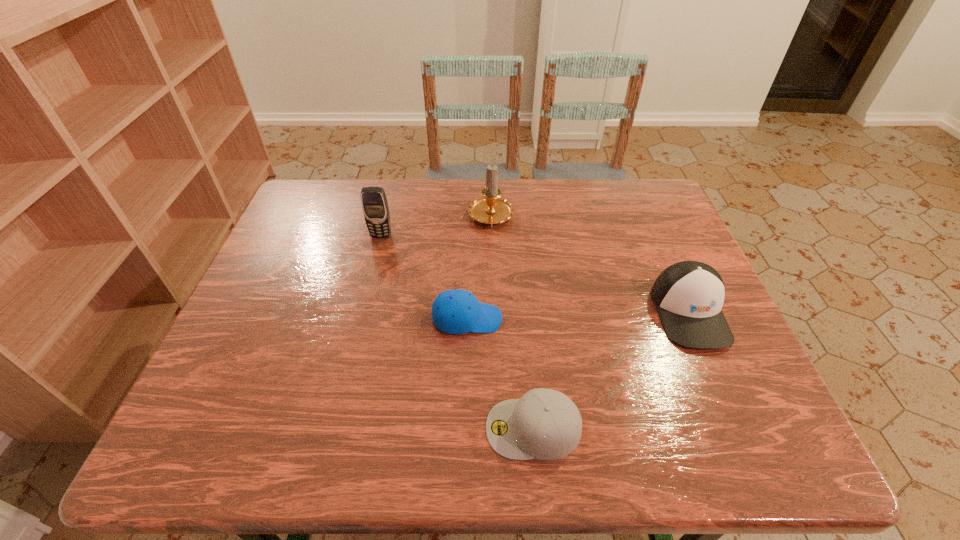
Where is `vacant area between the candle and the nearest object`? The height and width of the screenshot is (540, 960). vacant area between the candle and the nearest object is located at coordinates (512, 323).

What are the coordinates of `vacant point located between the nearest object and the candle` in the screenshot? It's located at (512, 323).

The width and height of the screenshot is (960, 540). I want to click on vacant area between the leftmost object and the tallest cap, so click(x=536, y=274).

You are a GUI agent. You are given a task and a screenshot of the screen. Output one action in this format:
    pyautogui.click(x=<x>, y=<y>)
    Task: Click on the empty location between the rightmost object and the nearest object
    
    Given the screenshot: What is the action you would take?
    pyautogui.click(x=612, y=370)

This screenshot has width=960, height=540. Identify the location of unoccupied area between the cellular telephone and the candle. (436, 227).

Locate which object ranks third in proximity to the leftmost object. Please provide its 2D coordinates. Your answer should be formatted as a tuple, i.e. [(x, y)], where the tuple contains the x and y coordinates of a point satisfying the conditions above.

[(545, 424)]

At what (x,y) coordinates should I click in order to perform the action: click on object that stands as the third closest to the nearest object. Please return your answer as a coordinate pair (x, y). Looking at the image, I should click on (491, 209).

Select which cap appears as the closest to the leftmost object. Please provide its 2D coordinates. Your answer should be formatted as a tuple, i.e. [(x, y)], where the tuple contains the x and y coordinates of a point satisfying the conditions above.

[(456, 311)]

Point out which cap is positioned as the nearest to the rightmost object. Please provide its 2D coordinates. Your answer should be formatted as a tuple, i.e. [(x, y)], where the tuple contains the x and y coordinates of a point satisfying the conditions above.

[(545, 424)]

You are a GUI agent. You are given a task and a screenshot of the screen. Output one action in this format:
    pyautogui.click(x=<x>, y=<y>)
    Task: Click on the free point that satisfies the following two spatial constraints: 1. on the front panel of the rightmost cap; 2. on the front-facing side of the nearest cap
    This screenshot has height=540, width=960.
    Given the screenshot: What is the action you would take?
    pyautogui.click(x=740, y=428)